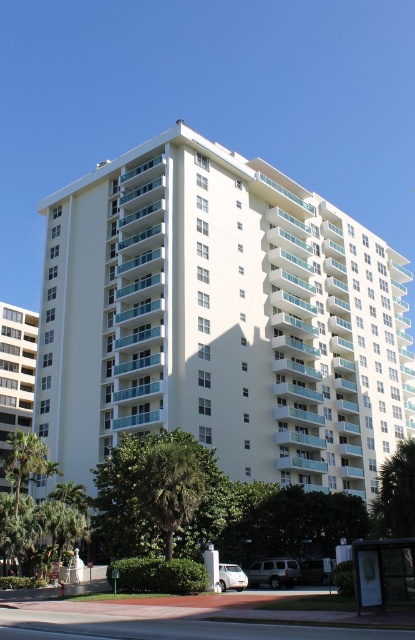
Does green leafy palm tree at lower center have a larger size compared to metallic silver bus stop at lower right?

Yes.

In the scene shown: Measure the distance between green leafy palm tree at lower center and camera.

green leafy palm tree at lower center is 41.86 meters from camera.

Locate an element on the screen. This screenshot has height=640, width=415. green leafy palm tree at lower center is located at coordinates (170, 481).

Which of these two, white smooth building at center or metallic silver bus stop at lower right, stands taller?

white smooth building at center is taller.

Is point (65, 458) positioned before point (383, 570)?

No, it is behind (383, 570).

You are a GUI agent. You are given a task and a screenshot of the screen. Output one action in this format:
    pyautogui.click(x=<x>, y=<y>)
    Task: Click on the white smooth building at center
    This screenshot has width=415, height=640.
    Given the screenshot: What is the action you would take?
    pyautogui.click(x=221, y=320)

Identify the location of white smooth building at center. Image resolution: width=415 pixels, height=640 pixels. (221, 320).

Between white smooth building at center and white concrete building at left, which one is positioned higher?

white smooth building at center is above.

Does point (222, 448) lie behind point (7, 352)?

No, it is in front of (7, 352).

Find the location of a particular element. This screenshot has height=640, width=415. white smooth building at center is located at coordinates (221, 320).

The width and height of the screenshot is (415, 640). I want to click on white smooth building at center, so click(221, 320).